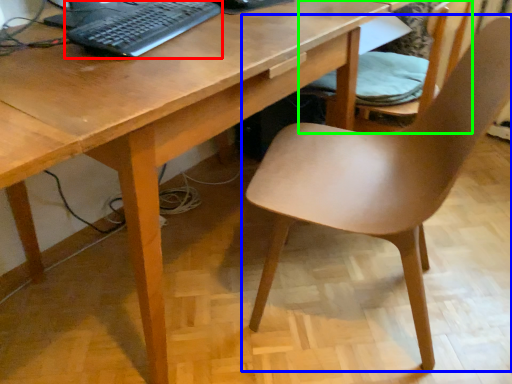
Question: Estimate the real-world distances between objects in this image. Which object is farther from computer keyboard (highlighted by a red box), chair (highlighted by a blue box) or chair (highlighted by a green box)?

Choices:
 (A) chair
 (B) chair

Answer: (B)